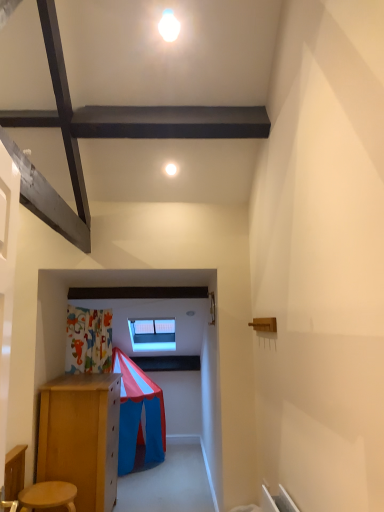
Question: From a real-world perspective, is wooden stool at lower left positioned above or below transparent glass window at center?

Choices:
 (A) below
 (B) above

Answer: (A)

Question: Would you say wooden stool at lower left is to the left or to the right of transparent glass window at center in the picture?

Choices:
 (A) left
 (B) right

Answer: (A)

Question: Estimate the real-world distances between objects in this image. Which object is farther from the wooden stool at lower left?

Choices:
 (A) transparent glass window at center
 (B) white glossy light at upper center

Answer: (A)

Question: Estimate the real-world distances between objects in this image. Which object is farther from the white glossy light at upper center?

Choices:
 (A) wooden stool at lower left
 (B) transparent glass window at center

Answer: (B)